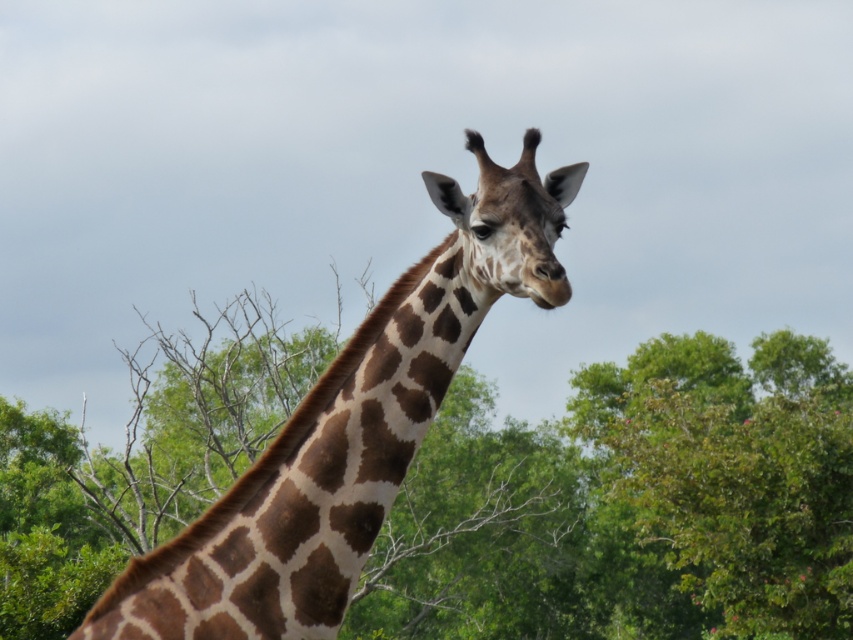
Does green leafy tree at center have a larger size compared to brown spotted giraffe head at center?

Yes, green leafy tree at center is bigger than brown spotted giraffe head at center.

Between green leafy tree at center and brown spotted giraffe head at center, which one is positioned lower?

green leafy tree at center

What do you see at coordinates (631, 504) in the screenshot? The width and height of the screenshot is (853, 640). I see `green leafy tree at center` at bounding box center [631, 504].

Find the location of a particular element. This screenshot has height=640, width=853. green leafy tree at center is located at coordinates (631, 504).

Can you confirm if brown spotted giraffe at center is bigger than brown spotted giraffe head at center?

Correct, brown spotted giraffe at center is larger in size than brown spotted giraffe head at center.

Is point (508, 179) positioned behind point (534, 188)?

Yes.

Find the location of a particular element. Image resolution: width=853 pixels, height=640 pixels. brown spotted giraffe at center is located at coordinates (350, 429).

Can you confirm if green leafy tree at center is positioned to the right of brown spotted giraffe at center?

In fact, green leafy tree at center is to the left of brown spotted giraffe at center.

Who is lower down, green leafy tree at center or brown spotted giraffe at center?

green leafy tree at center is below.

Between point (822, 419) and point (560, 202), which one is positioned behind?

The point (822, 419) is behind.

Identify the location of green leafy tree at center. The width and height of the screenshot is (853, 640). [x=631, y=504].